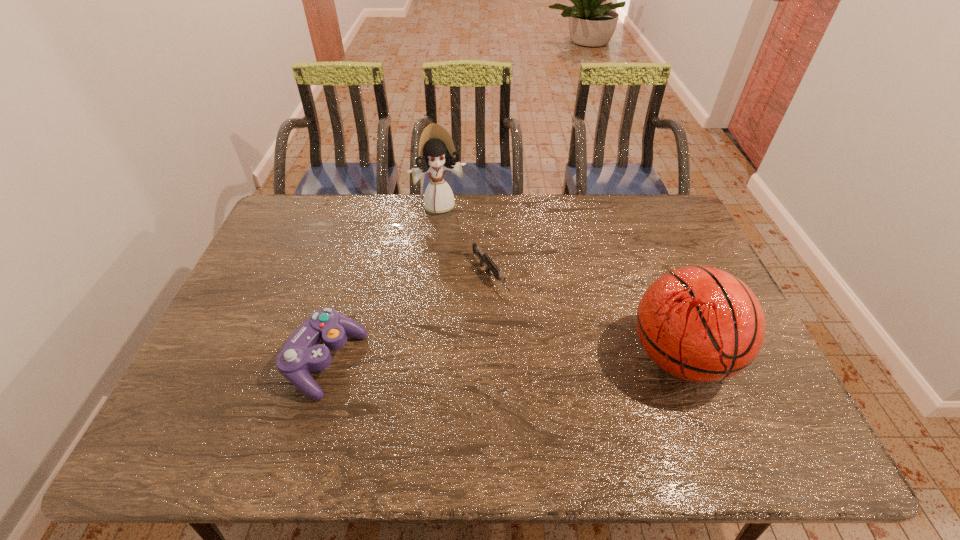
This screenshot has width=960, height=540. Find the location of `vacant space located 0.360m at the front face of the second object from left to right`. vacant space located 0.360m at the front face of the second object from left to right is located at coordinates (469, 288).

I want to click on free location located 0.370m aimed along the barrel of the second farthest object, so click(x=576, y=399).

Where is `vacant space located 0.290m aimed along the barrel of the second farthest object`? This screenshot has height=540, width=960. vacant space located 0.290m aimed along the barrel of the second farthest object is located at coordinates (557, 373).

Find the location of a particular element. vacant position located 0.380m aimed along the barrel of the second farthest object is located at coordinates (579, 402).

You are a GUI agent. You are given a task and a screenshot of the screen. Output one action in this format:
    pyautogui.click(x=<x>, y=<y>)
    Task: Click on the object at the far edge
    This screenshot has width=960, height=540.
    Given the screenshot: What is the action you would take?
    pyautogui.click(x=437, y=153)

You are a GUI agent. You are given a task and a screenshot of the screen. Output one action in this format:
    pyautogui.click(x=<x>, y=<y>)
    Task: Click on the control that is at the near edge
    The height and width of the screenshot is (540, 960).
    Given the screenshot: What is the action you would take?
    pyautogui.click(x=304, y=351)

You are a GUI agent. You are given a task and a screenshot of the screen. Output one action in this format:
    pyautogui.click(x=<x>, y=<y>)
    Task: Click on the basketball situated at the near edge
    
    Given the screenshot: What is the action you would take?
    pyautogui.click(x=701, y=324)

This screenshot has width=960, height=540. Find the location of `object present at the right edge`. object present at the right edge is located at coordinates 701,324.

I want to click on object that is positioned at the near right corner, so click(x=701, y=324).

The height and width of the screenshot is (540, 960). In the image, there is a desktop. Identify the location of free region at the far edge. (516, 232).